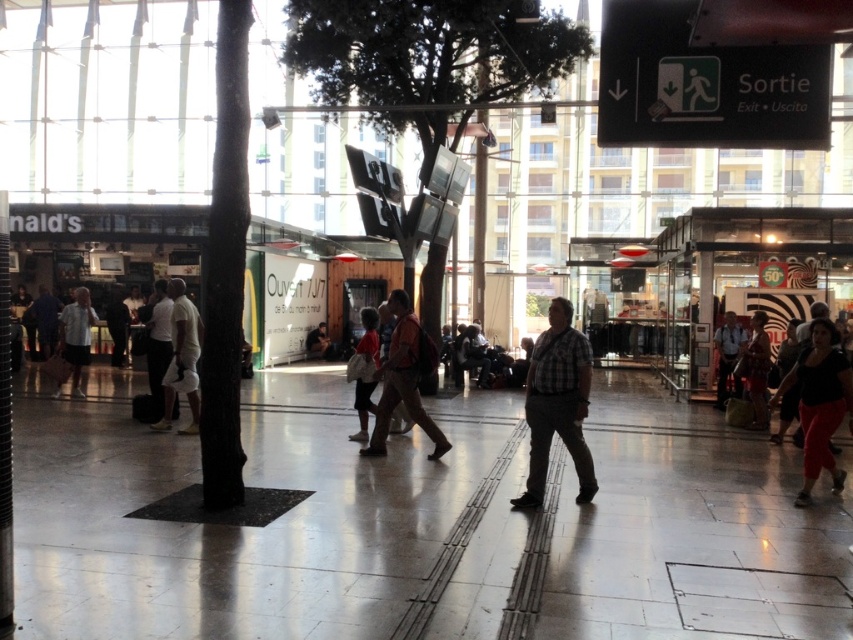
Question: Which object is the farthest from the matte black suitcase at center?

Choices:
 (A) white matte shorts at center
 (B) plaid shirt at center

Answer: (B)

Question: Is plaid shirt at center wider than white matte shorts at center?

Choices:
 (A) yes
 (B) no

Answer: (B)

Question: In this image, where is white glossy pavement at center located relative to matte black suitcase at center?

Choices:
 (A) below
 (B) above

Answer: (A)

Question: Which point appears closest to the camera in this image?

Choices:
 (A) click(73, 404)
 (B) click(189, 316)
 (C) click(152, 324)

Answer: (B)

Question: Which object appears farthest from the camera in this image?

Choices:
 (A) white matte shorts at center
 (B) plaid shirt at center
 (C) brown leather jacket at center
 (D) white glossy pavement at center

Answer: (A)

Question: Can you confirm if plaid shirt at center is bigger than brown leather jacket at center?

Choices:
 (A) no
 (B) yes

Answer: (A)